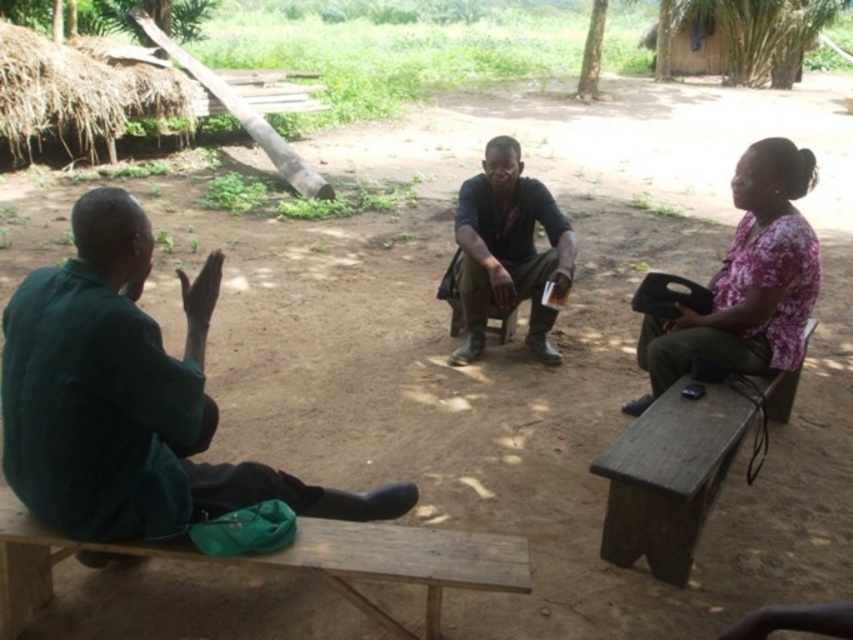
You are a photographer standing at the center of the scene. You want to take a photo of the pink floral shirt at upper right and the wooden bench at lower left. Can you fit both in your camera frame if your camera has a maximum horizontal field of view of 1.7 meters?

The distance between the pink floral shirt at upper right and the wooden bench at lower left is 1.69 meters, which is just under the camera frame limit of 1.7 meters. Yes, both objects can fit within the camera frame.